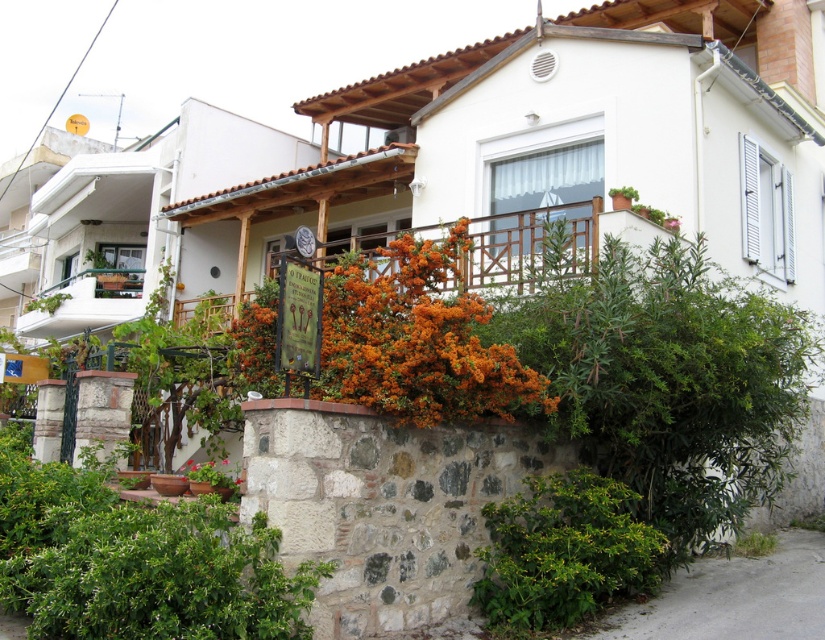
You are a gardener who wants to plant a new flower bed between the orange matte flowers at center and the green leafy bush at lower center. The new flower bed requires a minimum of 4 feet of space. Based on the scene, is there enough space for the flower bed?

The orange matte flowers at center and green leafy bush at lower center are 3.71 feet apart from each other. Since the required space for the flower bed is 4 feet, there is not enough space between them to accommodate the new flower bed.

You are standing in front of the Mediterranean house and want to determine which object is taller between the white painted wood at left and the green leafy plant at lower right. Based on the scene, can you identify which one is taller?

The white painted wood at left has a greater height compared to the green leafy plant at lower right, so the white painted wood at left is taller.

Looking at this image, you are a gardener looking at the Mediterranean house and its surroundings. You see the green leafy bush at lower center and the green leafy plant at lower right. Which one is taller?

The green leafy bush at lower center is taller than the green leafy plant at lower right.